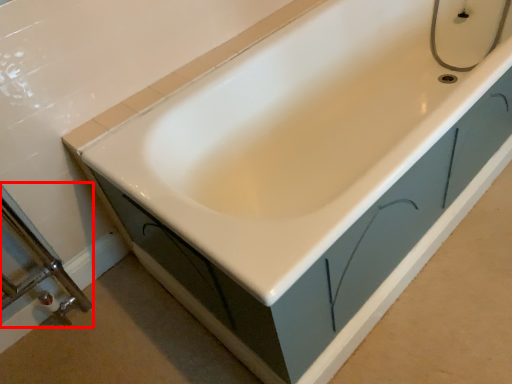
Question: From the image's perspective, what is the correct spatial positioning of shower door (annotated by the red box) in reference to plumbing fixture?

Choices:
 (A) above
 (B) below

Answer: (B)